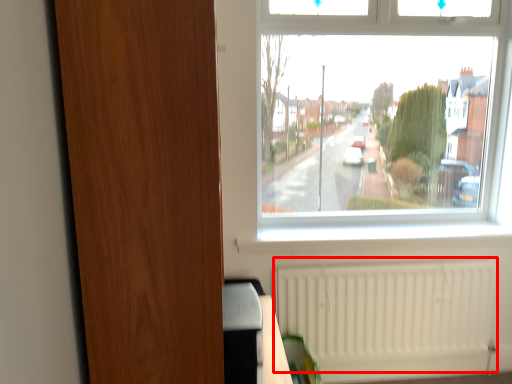
Question: Considering the relative positions of radiator (annotated by the red box) and screen door in the image provided, where is radiator (annotated by the red box) located with respect to the staircase?

Choices:
 (A) left
 (B) right

Answer: (B)